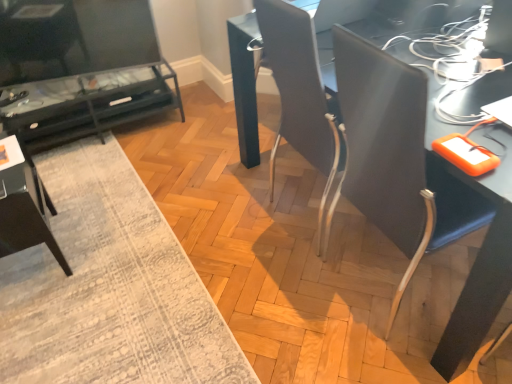
You are a GUI agent. You are given a task and a screenshot of the screen. Output one action in this format:
    pyautogui.click(x=<x>, y=<y>)
    Task: Click on the vacant space underneath textured gray rug at lower left (from a real-world perspective)
    The width and height of the screenshot is (512, 384).
    Given the screenshot: What is the action you would take?
    pyautogui.click(x=100, y=256)